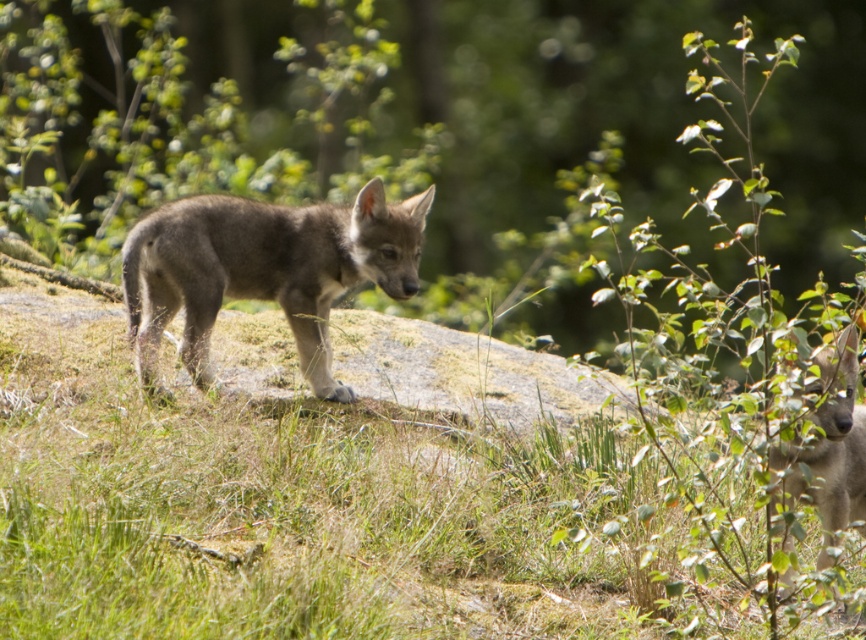
Is gray fur wolf pup at center thinner than gray fur dog at right?

Incorrect, gray fur wolf pup at center's width is not less than gray fur dog at right's.

At what (x,y) coordinates should I click in order to perform the action: click on gray fur wolf pup at center. Please return your answer as a coordinate pair (x, y). Looking at the image, I should click on (263, 269).

You are a GUI agent. You are given a task and a screenshot of the screen. Output one action in this format:
    pyautogui.click(x=<x>, y=<y>)
    Task: Click on the gray fur wolf pup at center
    This screenshot has width=866, height=640.
    Given the screenshot: What is the action you would take?
    pyautogui.click(x=263, y=269)

Does green grassy at center have a greater height compared to gray fur dog at right?

Correct, green grassy at center is much taller as gray fur dog at right.

Where is `green grassy at center`? The image size is (866, 640). green grassy at center is located at coordinates (311, 504).

Is point (595, 516) in front of point (824, 355)?

No, (595, 516) is behind (824, 355).

Locate an element on the screen. green grassy at center is located at coordinates (311, 504).

Does green grassy at center have a greater width compared to gray fur wolf pup at center?

Yes.

Measure the distance between point (154, 596) and camera.

The distance of point (154, 596) from camera is 3.16 meters.

Identify the location of green grassy at center. This screenshot has height=640, width=866. coord(311,504).